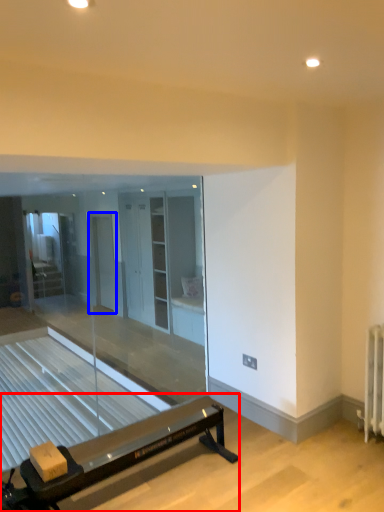
Question: Which object appears farthest to the camera in this image, furniture (highlighted by a red box) or screen door (highlighted by a blue box)?

Choices:
 (A) furniture
 (B) screen door

Answer: (B)